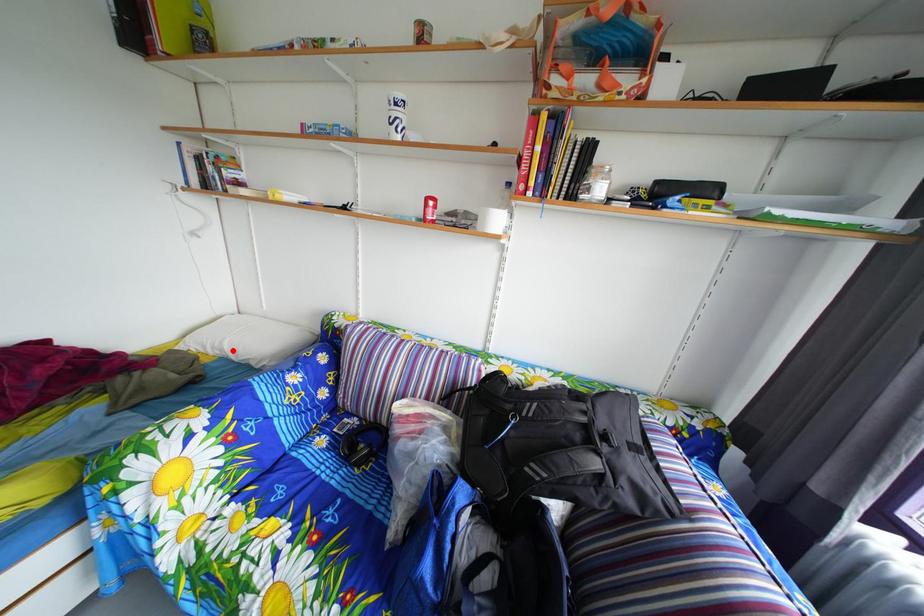
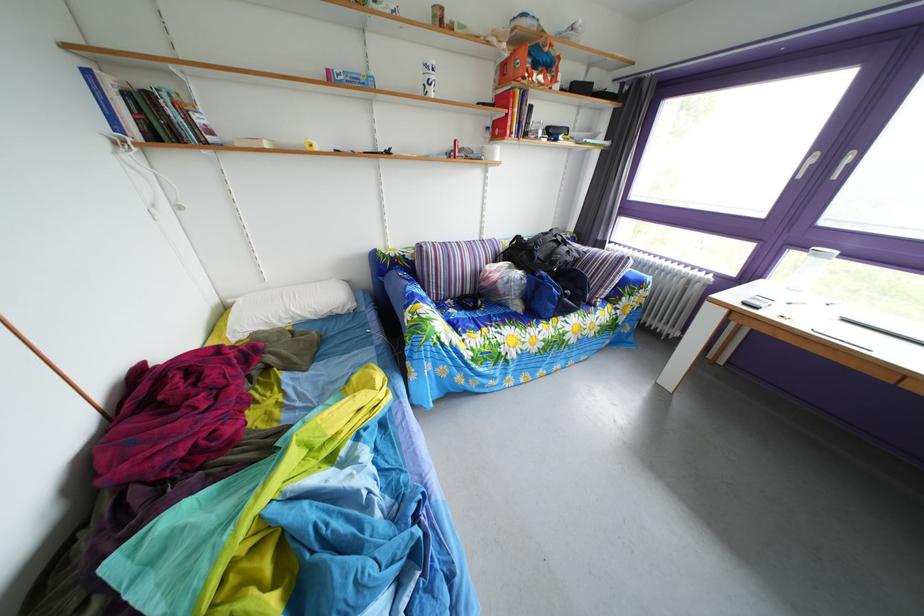
Question: I am providing you with two images of the same scene from different viewpoints. A red point is shown in image1. For the corresponding object point in image2, is it positioned nearer or farther from the camera?

Choices:
 (A) Nearer
 (B) Farther

Answer: (A)